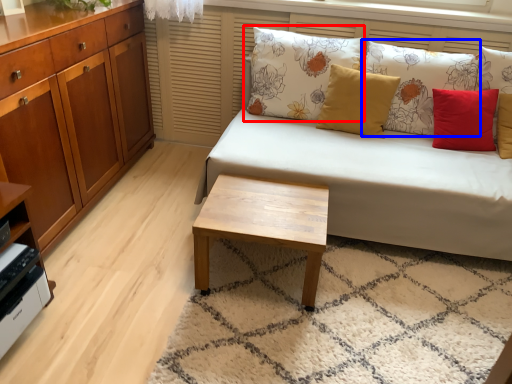
Question: Which object appears closest to the camera in this image, pillow (highlighted by a red box) or pillow (highlighted by a blue box)?

Choices:
 (A) pillow
 (B) pillow

Answer: (B)